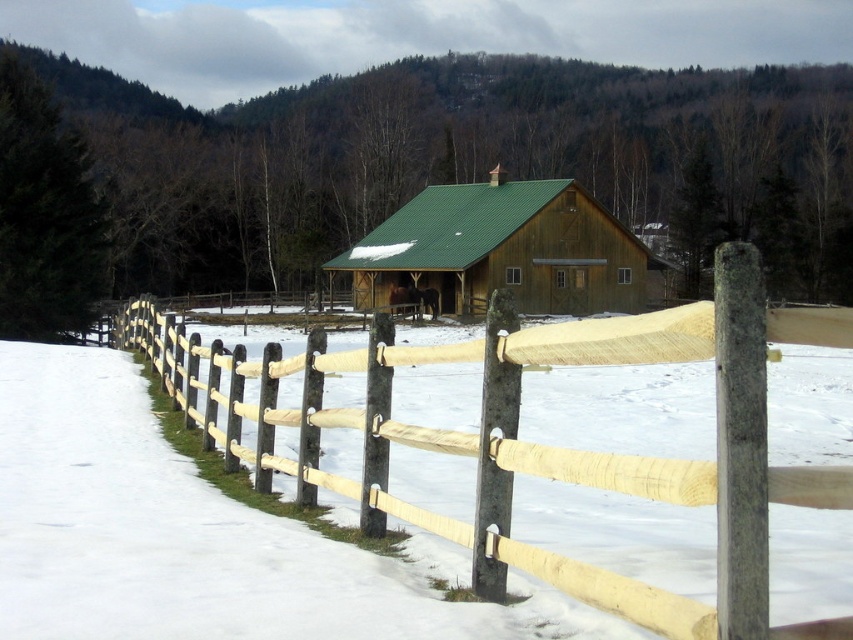
You are standing in the snowy field and want to take a photo of the green wooden barn at center and the gray wood post at center. Which object will appear closer to you in the photo?

The gray wood post at center is behind the green wooden barn at center, so the green wooden barn at center will appear closer to you in the photo.

You are a farmer checking the boundaries of your property. You see the wooden split rail fence at center and the gray wood post at center. Which object is closer to you?

The wooden split rail fence at center is closer to you than the gray wood post at center.